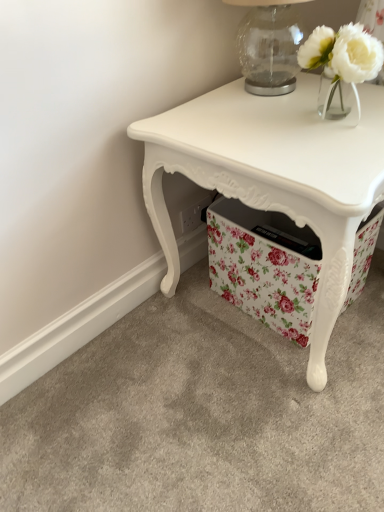
The width and height of the screenshot is (384, 512). What are the coordinates of `free space on the front side of white glossy table at center` in the screenshot? It's located at (262, 426).